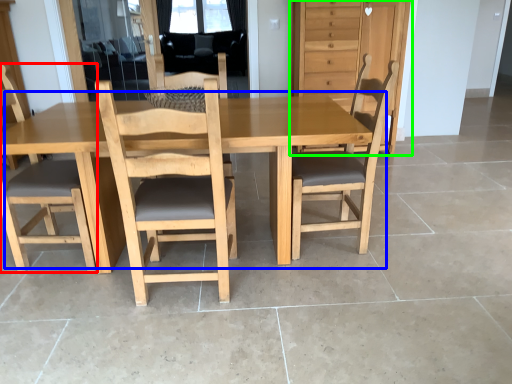
Question: Which object is positioned closest to chair (highlighted by a red box)? Select from table (highlighted by a blue box) and dresser (highlighted by a green box).

Choices:
 (A) table
 (B) dresser

Answer: (A)